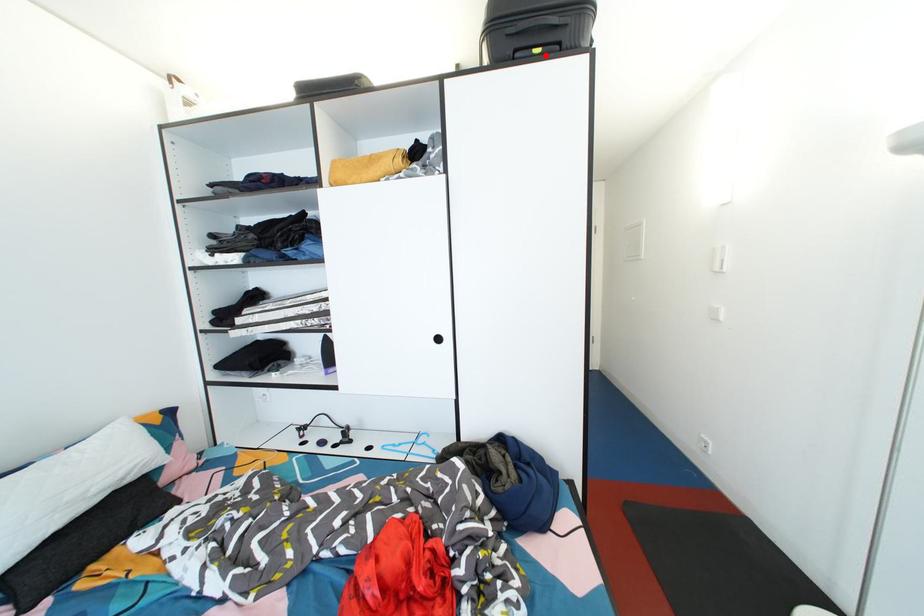
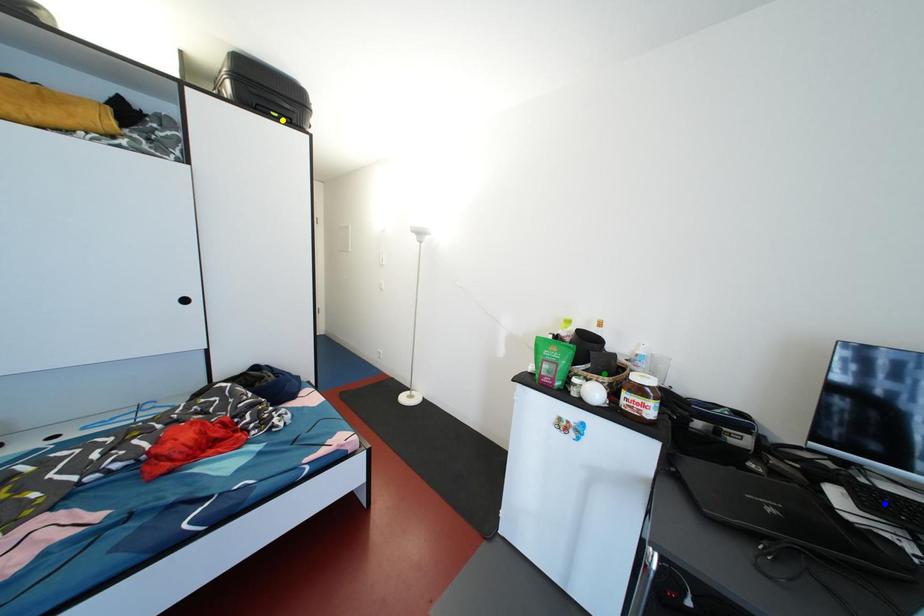
Question: I am providing you with two images of the same scene from different viewpoints. A red point is marked on the first image. You are given multiple points on the second image. Which mark in image 2 goes with the point in image 1?

Choices:
 (A) blue point
 (B) green point
 (C) yellow point

Answer: (C)